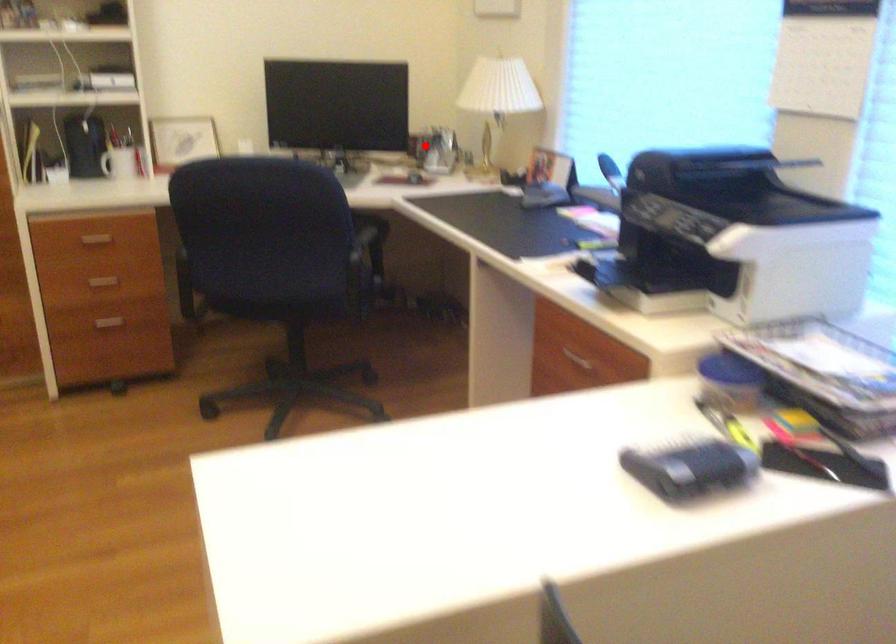
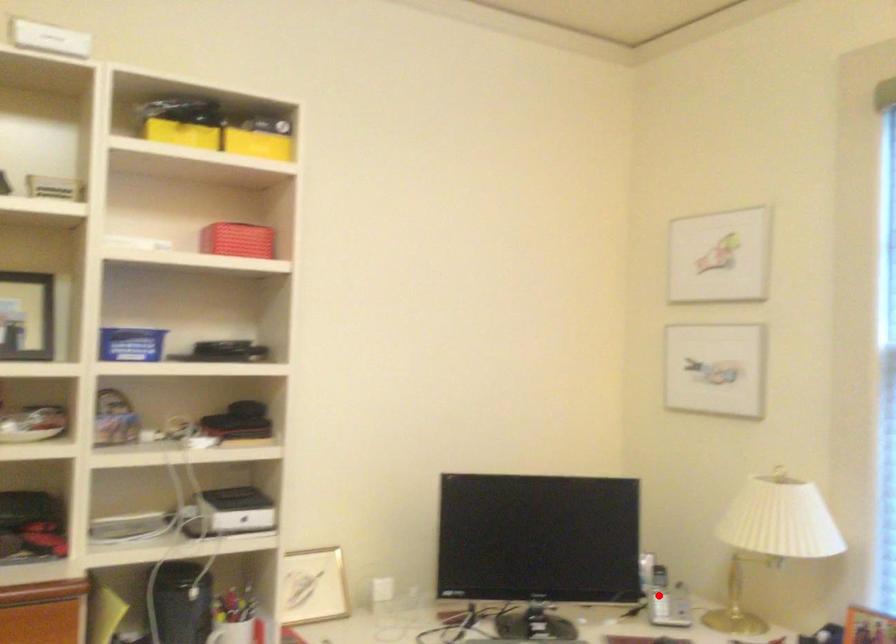
I am providing you with two images of the same scene from different viewpoints. A red point is marked on the first image and another point is marked on the second image. Does the point marked in image1 correspond to the same location as the one in image2?

Yes